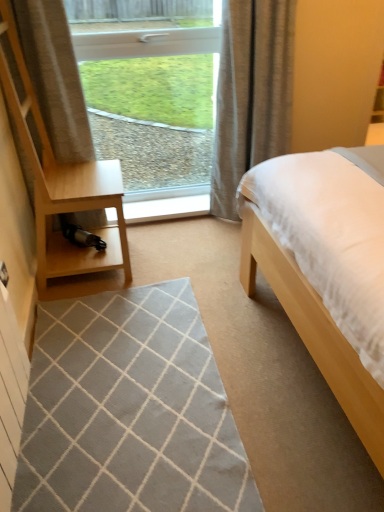
Question: Is light wood/dark finish dresser at left to the left of gray woven mat at center from the viewer's perspective?

Choices:
 (A) no
 (B) yes

Answer: (B)

Question: Would you consider light wood/dark finish dresser at left to be distant from gray woven mat at center?

Choices:
 (A) no
 (B) yes

Answer: (A)

Question: Can you confirm if light wood/dark finish dresser at left is bigger than gray woven mat at center?

Choices:
 (A) yes
 (B) no

Answer: (A)

Question: Does light wood/dark finish dresser at left have a greater width compared to gray woven mat at center?

Choices:
 (A) no
 (B) yes

Answer: (A)

Question: From the image's perspective, is light wood/dark finish dresser at left beneath gray woven mat at center?

Choices:
 (A) yes
 (B) no

Answer: (B)

Question: Is light wood/dark finish dresser at left positioned behind gray woven mat at center?

Choices:
 (A) yes
 (B) no

Answer: (A)

Question: Is white plastic window at upper center to the left of gray woven mat at center from the viewer's perspective?

Choices:
 (A) no
 (B) yes

Answer: (A)

Question: From a real-world perspective, does white plastic window at upper center sit lower than gray woven mat at center?

Choices:
 (A) no
 (B) yes

Answer: (A)

Question: Does white plastic window at upper center have a larger size compared to gray woven mat at center?

Choices:
 (A) yes
 (B) no

Answer: (A)

Question: Can you confirm if white plastic window at upper center is smaller than gray woven mat at center?

Choices:
 (A) yes
 (B) no

Answer: (B)

Question: Is white plastic window at upper center looking in the opposite direction of gray woven mat at center?

Choices:
 (A) yes
 (B) no

Answer: (B)

Question: Could you tell me if white plastic window at upper center is turned towards gray woven mat at center?

Choices:
 (A) no
 (B) yes

Answer: (B)

Question: Considering the relative sizes of gray woven mat at center and light wood/dark finish dresser at left in the image provided, is gray woven mat at center wider than light wood/dark finish dresser at left?

Choices:
 (A) yes
 (B) no

Answer: (A)